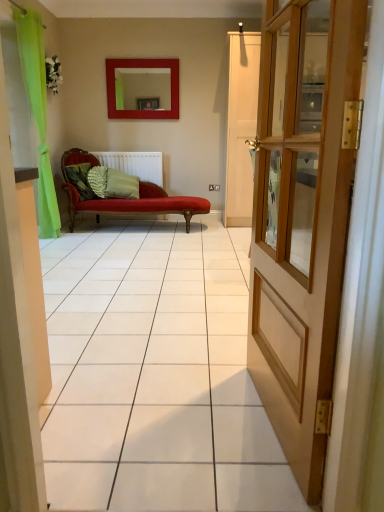
Question: Does matte red mirror at upper center have a larger size compared to wooden door at right?

Choices:
 (A) yes
 (B) no

Answer: (B)

Question: Could you tell me if matte red mirror at upper center is turned towards wooden door at right?

Choices:
 (A) no
 (B) yes

Answer: (B)

Question: Is matte red mirror at upper center to the left of wooden door at right from the viewer's perspective?

Choices:
 (A) yes
 (B) no

Answer: (A)

Question: Does matte red mirror at upper center appear on the right side of wooden door at right?

Choices:
 (A) yes
 (B) no

Answer: (B)

Question: From the image's perspective, is matte red mirror at upper center below wooden door at right?

Choices:
 (A) no
 (B) yes

Answer: (A)

Question: Is matte red mirror at upper center next to wooden door at right?

Choices:
 (A) no
 (B) yes

Answer: (A)

Question: Can you confirm if green textured pillow at center, the second pillow from the left, is shorter than green fabric pillow at center, the first pillow in the right-to-left sequence?

Choices:
 (A) yes
 (B) no

Answer: (A)

Question: From a real-world perspective, is green textured pillow at center, the second pillow in the right-to-left sequence, below green fabric pillow at center, the first pillow in the right-to-left sequence?

Choices:
 (A) yes
 (B) no

Answer: (A)

Question: Is green textured pillow at center, the second pillow from the left, wider than green fabric pillow at center, the first pillow in the right-to-left sequence?

Choices:
 (A) no
 (B) yes

Answer: (A)

Question: Is green textured pillow at center, the second pillow from the left, positioned far away from green fabric pillow at center, positioned as the 3th pillow in left-to-right order?

Choices:
 (A) no
 (B) yes

Answer: (A)

Question: Is the depth of green textured pillow at center, the second pillow in the right-to-left sequence, less than that of green fabric pillow at center, positioned as the 3th pillow in left-to-right order?

Choices:
 (A) no
 (B) yes

Answer: (B)

Question: Could you tell me if green textured pillow at center, the second pillow from the left, is facing green fabric pillow at center, positioned as the 3th pillow in left-to-right order?

Choices:
 (A) no
 (B) yes

Answer: (B)

Question: From the image's perspective, does green fabric pillow at center, positioned as the 3th pillow in left-to-right order, appear lower than white matte radiator at center?

Choices:
 (A) no
 (B) yes

Answer: (B)